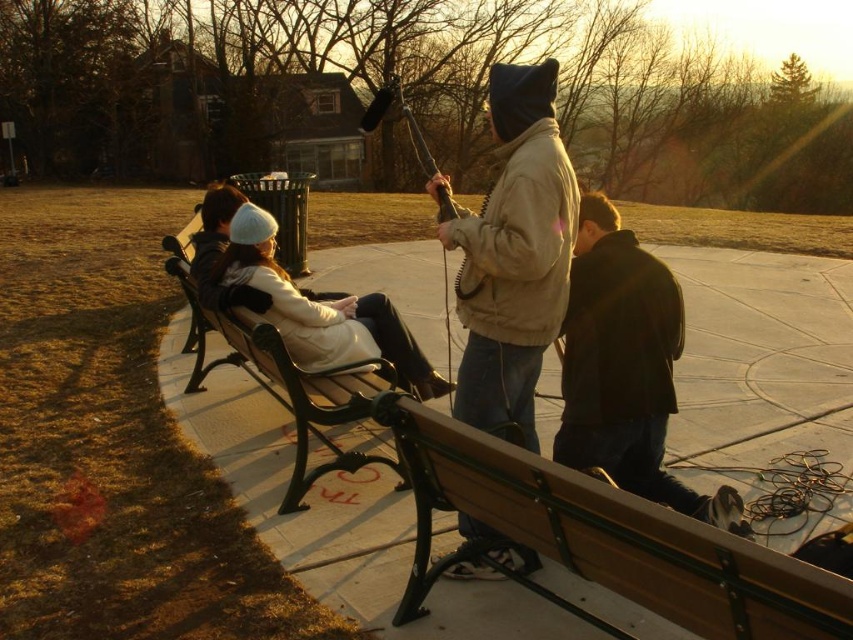
You are standing on the paved walkway and want to sit on the wooden bench at center. There is a dark brown leather jacket at lower right in your way. Can you walk around it to reach the bench?

The dark brown leather jacket at lower right is closer to the viewer than the wooden bench at center, so you can walk around it to reach the bench.